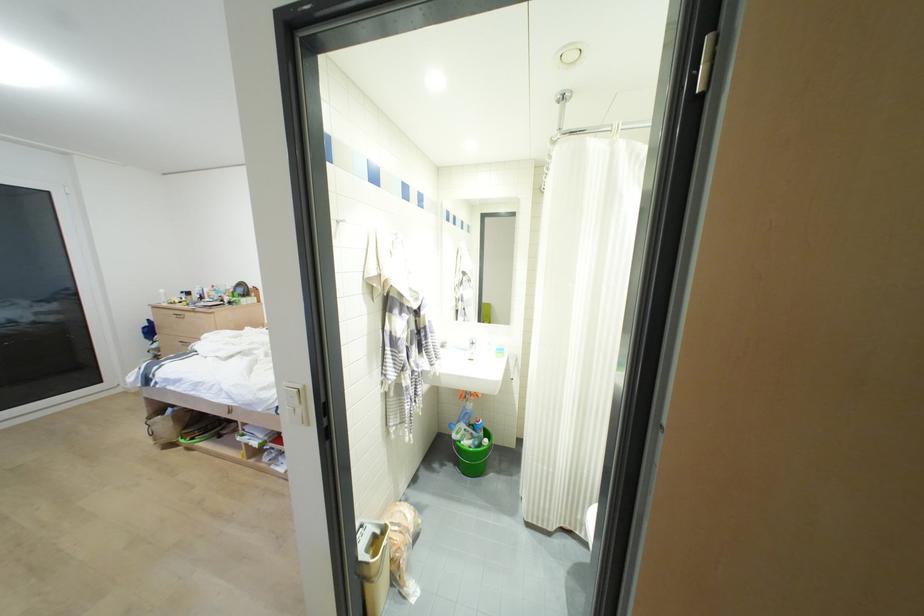
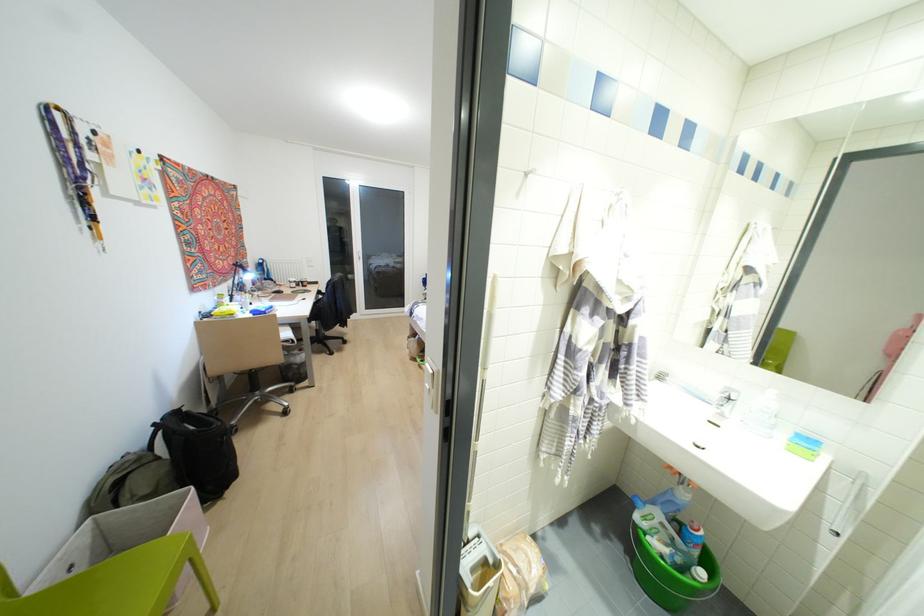
Find the pixel in the second image that matches pixel 455 440 in the first image.

(636, 525)